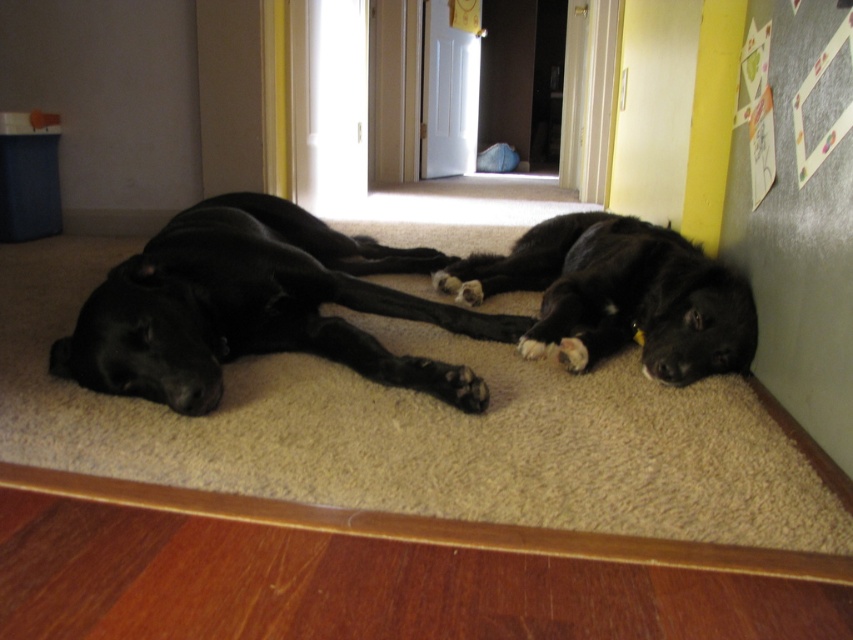
You are a pet sitter entering the room. You notice the beige carpet at center and the black smooth dog at center. Which object is closer to you as you stand at the entrance?

The beige carpet at center is in front of the black smooth dog at center, so the beige carpet at center is closer to you.

You are a pet sitter entering the room and need to place a new dog bed. The bed requires 1.2 meters of space. Given the beige carpet at center and the black matte dog at lower right, which area has enough space for the bed?

The beige carpet at center has a width that surpasses the black matte dog at lower right, so the beige carpet at center likely has enough space for the 1.2 meter dog bed.